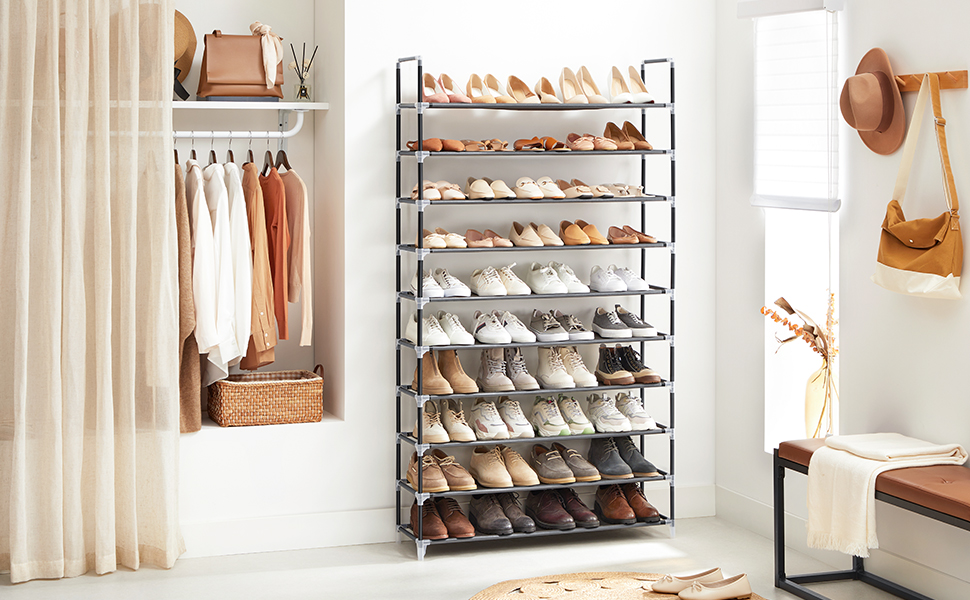
This screenshot has height=600, width=970. I want to click on shelves, so click(x=573, y=106), click(x=602, y=154), click(x=608, y=203), click(x=599, y=251), click(x=605, y=294), click(x=598, y=338), click(x=602, y=385), click(x=600, y=437), click(x=603, y=482), click(x=601, y=534).